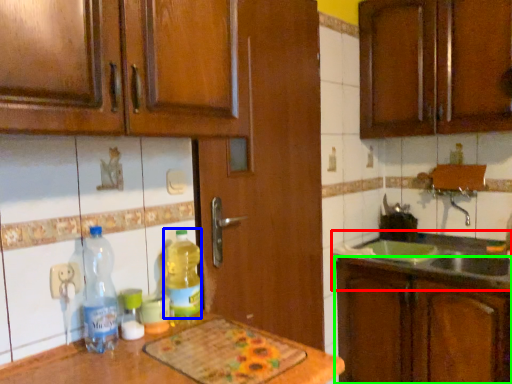
Question: Considering the real-world distances, which object is farthest from sink (highlighted by a red box)? bottle (highlighted by a blue box) or cabinetry (highlighted by a green box)?

Choices:
 (A) bottle
 (B) cabinetry

Answer: (A)